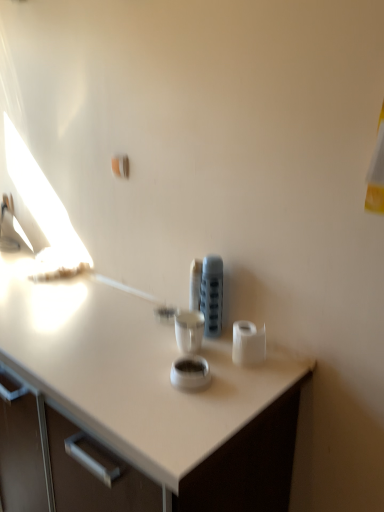
Question: From a real-world perspective, relative to white matte toilet paper at right, is matte plastic container at center vertically above or below?

Choices:
 (A) above
 (B) below

Answer: (A)

Question: Is matte plastic container at center bigger or smaller than white matte toilet paper at right?

Choices:
 (A) big
 (B) small

Answer: (A)

Question: Considering the positions of point (215, 304) and point (251, 362), is point (215, 304) closer or farther from the camera than point (251, 362)?

Choices:
 (A) closer
 (B) farther

Answer: (B)

Question: Would you say white matte toilet paper at right is to the left or to the right of matte plastic container at center in the picture?

Choices:
 (A) right
 (B) left

Answer: (A)

Question: In the image, is white matte toilet paper at right positioned in front of or behind matte plastic container at center?

Choices:
 (A) behind
 (B) front

Answer: (B)

Question: Looking at the image, does white matte toilet paper at right seem bigger or smaller compared to matte plastic container at center?

Choices:
 (A) small
 (B) big

Answer: (A)

Question: From the image's perspective, is white matte toilet paper at right located above or below matte plastic container at center?

Choices:
 (A) below
 (B) above

Answer: (A)